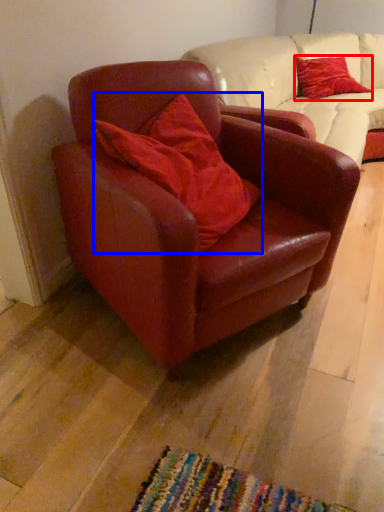
Question: Among these objects, which one is nearest to the camera, pillow (highlighted by a red box) or pillow (highlighted by a blue box)?

Choices:
 (A) pillow
 (B) pillow

Answer: (B)